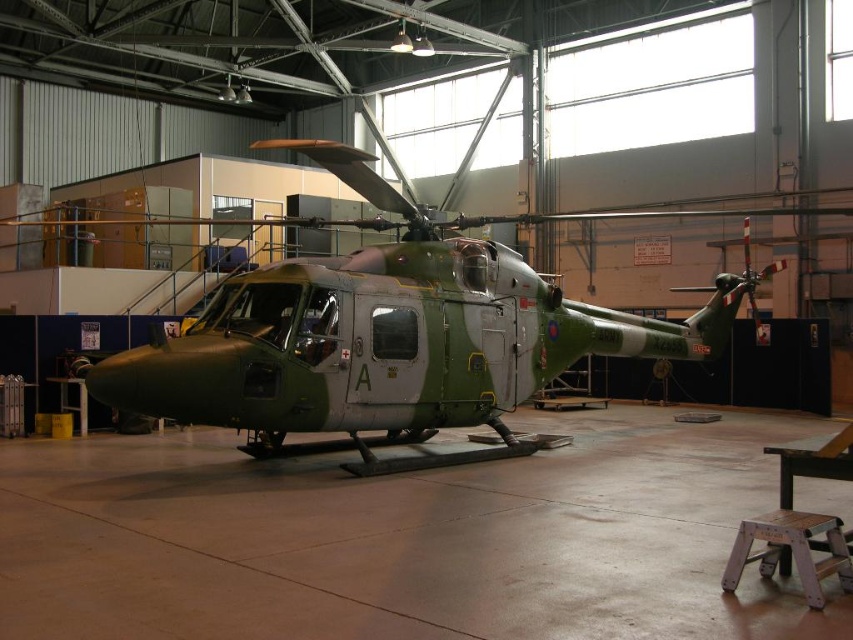
In the scene shown: You are a maintenance worker needing to move the wooden stool at lower right closer to the camouflage paint helicopter at center for easier access to the tail rotor. Considering their sizes, will the stool be able to fit under the helicopter without being obstructed by its larger size?

The camouflage paint helicopter at center is larger than the wooden stool at lower right, so the stool can fit under the helicopter as it is smaller in size and less likely to be obstructed by the helicopter.

You are a maintenance worker who needs to inspect the camouflage paint helicopter at center and the wooden stool at lower right. Which object will require you to look upwards more while inspecting?

The camouflage paint helicopter at center is much taller than the wooden stool at lower right, so you will need to look upwards more while inspecting the camouflage paint helicopter at center.

You are a mechanic who needs to access the engine compartment of the camouflage paint helicopter at center. There is a wooden stool at lower right nearby. Can you place the stool directly underneath the helicopter to reach the engine?

The camouflage paint helicopter at center is positioned over the wooden stool at lower right, so the stool is already located underneath the helicopter. You can use it to access the engine compartment.